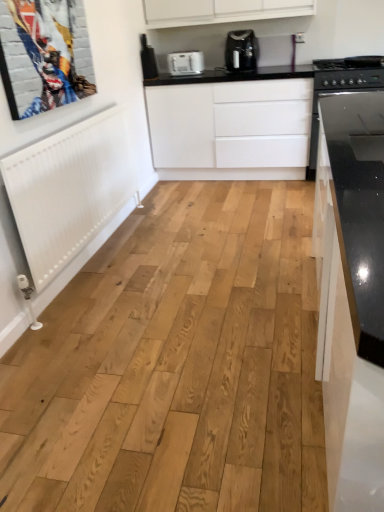
The height and width of the screenshot is (512, 384). Describe the element at coordinates (349, 72) in the screenshot. I see `black glass stove at right` at that location.

Find the location of a particular element. The width and height of the screenshot is (384, 512). satin black coffee maker at upper center is located at coordinates (241, 50).

The height and width of the screenshot is (512, 384). I want to click on white plastic toaster at upper center, so click(186, 63).

This screenshot has width=384, height=512. What do you see at coordinates (231, 124) in the screenshot?
I see `white matte cabinet at center` at bounding box center [231, 124].

This screenshot has width=384, height=512. What are the coordinates of `metallic silver picture frame at upper left` in the screenshot? It's located at (44, 55).

From the picture: Is black glass stove at right directly adjacent to satin black coffee maker at upper center?

black glass stove at right and satin black coffee maker at upper center are clearly separated.

Is black glass stove at right turned away from satin black coffee maker at upper center?

black glass stove at right is not turned away from satin black coffee maker at upper center.

Can you tell me how much black glass stove at right and satin black coffee maker at upper center differ in facing direction?

There is a 1.14-degree angle between the facing directions of black glass stove at right and satin black coffee maker at upper center.

Which of these two, black glass stove at right or satin black coffee maker at upper center, is wider?

black glass stove at right is wider.

From the image's perspective, is white plastic toaster at upper center located above or below metallic silver picture frame at upper left?

white plastic toaster at upper center is situated higher than metallic silver picture frame at upper left in the image.

Does white plastic toaster at upper center have a lesser height compared to metallic silver picture frame at upper left?

Correct, white plastic toaster at upper center is not as tall as metallic silver picture frame at upper left.

Is white plastic toaster at upper center outside of metallic silver picture frame at upper left?

Yes, white plastic toaster at upper center is outside of metallic silver picture frame at upper left.

How many degrees apart are the facing directions of white plastic toaster at upper center and metallic silver picture frame at upper left?

89.4 degrees.

From the image's perspective, is white matte cabinet at center over white plastic toaster at upper center?

No, from the image's perspective, white matte cabinet at center is not on top of white plastic toaster at upper center.

Does white matte cabinet at center appear on the left side of white plastic toaster at upper center?

In fact, white matte cabinet at center is to the right of white plastic toaster at upper center.

Considering the relative sizes of white matte cabinet at center and white plastic toaster at upper center in the image provided, is white matte cabinet at center smaller than white plastic toaster at upper center?

No.

Is satin black coffee maker at upper center to the right of white plastic toaster at upper center from the viewer's perspective?

Yes.

Is point (237, 63) more distant than point (189, 68)?

Yes.

Is the surface of satin black coffee maker at upper center in direct contact with white plastic toaster at upper center?

satin black coffee maker at upper center and white plastic toaster at upper center are not in contact.

Is white plastic toaster at upper center completely or partially inside satin black coffee maker at upper center?

Actually, white plastic toaster at upper center is outside satin black coffee maker at upper center.

From the image's perspective, which one is positioned higher, metallic silver picture frame at upper left or white matte cabinet at center?

white matte cabinet at center, from the image's perspective.

Is metallic silver picture frame at upper left wider than white matte cabinet at center?

No, metallic silver picture frame at upper left is not wider than white matte cabinet at center.

Which point is more forward, (41,3) or (283,117)?

The point (41,3) is in front.

Is metallic silver picture frame at upper left facing towards white matte cabinet at center?

No.

Is black glass stove at right positioned beyond the bounds of metallic silver picture frame at upper left?

Yes.

Find the location of a particular element. picture frame in front of the black glass stove at right is located at coordinates (44, 55).

From a real-world perspective, is black glass stove at right physically below metallic silver picture frame at upper left?

Yes.

How many degrees apart are the facing directions of black glass stove at right and metallic silver picture frame at upper left?

They differ by 90.5 degrees in their facing directions.

Does metallic silver picture frame at upper left have a greater width compared to satin black coffee maker at upper center?

Incorrect, the width of metallic silver picture frame at upper left does not surpass that of satin black coffee maker at upper center.

From a real-world perspective, is metallic silver picture frame at upper left physically located above or below satin black coffee maker at upper center?

metallic silver picture frame at upper left is above satin black coffee maker at upper center.

Find the location of `picture frame that is in front of the satin black coffee maker at upper center`. picture frame that is in front of the satin black coffee maker at upper center is located at coordinates (44, 55).

This screenshot has width=384, height=512. Identify the location of stove on the right of satin black coffee maker at upper center. (349, 72).

Locate an element on the screen. kitchen appliance behind the metallic silver picture frame at upper left is located at coordinates (186, 63).

From the image, which object appears to be nearer to black glass stove at right, metallic silver picture frame at upper left or satin black coffee maker at upper center?

satin black coffee maker at upper center lies closer to black glass stove at right than the other object.

Considering their positions, is black glass stove at right positioned further to white plastic toaster at upper center than metallic silver picture frame at upper left?

Based on the image, metallic silver picture frame at upper left appears to be further to white plastic toaster at upper center.

Considering their positions, is satin black coffee maker at upper center positioned further to black glass stove at right than white matte cabinet at center?

Based on the image, satin black coffee maker at upper center appears to be further to black glass stove at right.

When comparing their distances from metallic silver picture frame at upper left, does satin black coffee maker at upper center or white matte cabinet at center seem further?

The object further to metallic silver picture frame at upper left is satin black coffee maker at upper center.

Considering their positions, is black glass stove at right positioned closer to satin black coffee maker at upper center than white matte cabinet at center?

white matte cabinet at center is positioned closer to the anchor satin black coffee maker at upper center.

Based on their spatial positions, is metallic silver picture frame at upper left or black glass stove at right closer to satin black coffee maker at upper center?

black glass stove at right.

Looking at the image, which one is located closer to white matte cabinet at center, black glass stove at right or satin black coffee maker at upper center?

satin black coffee maker at upper center.

Considering their positions, is black glass stove at right positioned further to white matte cabinet at center than white plastic toaster at upper center?

black glass stove at right lies further to white matte cabinet at center than the other object.

You are a GUI agent. You are given a task and a screenshot of the screen. Output one action in this format:
    pyautogui.click(x=<x>, y=<y>)
    Task: Click on the kitchen appliance that lies between satin black coffee maker at upper center and white matte cabinet at center from top to bottom
    The image size is (384, 512).
    Given the screenshot: What is the action you would take?
    pyautogui.click(x=186, y=63)

What are the coordinates of `home appliance located between metallic silver picture frame at upper left and white plastic toaster at upper center in the depth direction` in the screenshot? It's located at (241, 50).

What are the coordinates of `cabinetry between metallic silver picture frame at upper left and satin black coffee maker at upper center in the front-back direction` in the screenshot? It's located at (231, 124).

Identify the location of home appliance between metallic silver picture frame at upper left and black glass stove at right. The image size is (384, 512). pos(241,50).